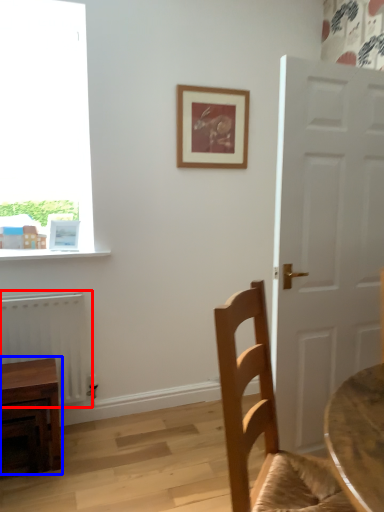
Question: Which of the following is the farthest to the observer, radiator (highlighted by a red box) or table (highlighted by a blue box)?

Choices:
 (A) radiator
 (B) table

Answer: (A)